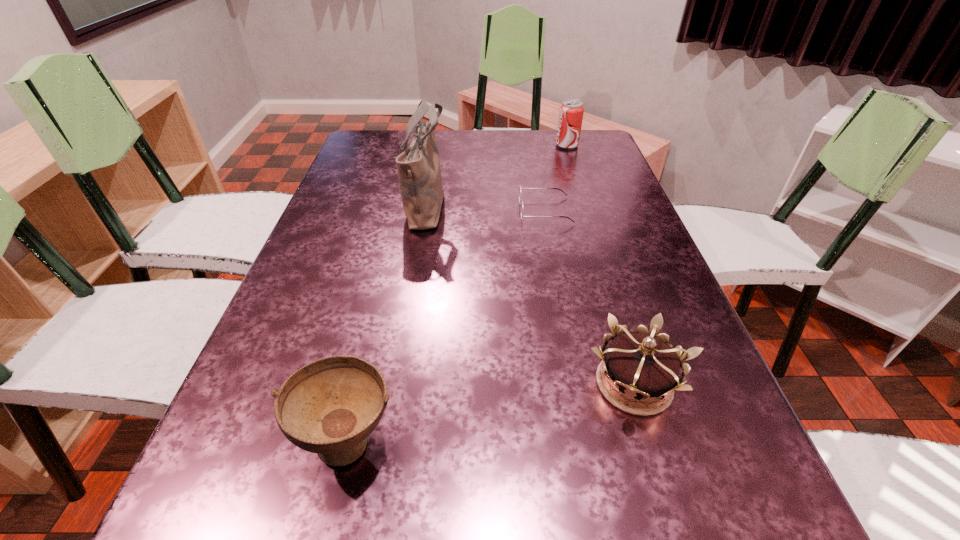
Identify the location of free space located 0.390m on the front-facing side of the spectacles. Image resolution: width=960 pixels, height=540 pixels. (372, 211).

The image size is (960, 540). What are the coordinates of `blank area located 0.310m on the front-facing side of the spectacles` in the screenshot? It's located at (402, 211).

Locate an element on the screen. object present at the far edge is located at coordinates pyautogui.click(x=571, y=112).

Find the location of a particular element. object that is positioned at the left edge is located at coordinates (330, 406).

Locate an element on the screen. soda can that is positioned at the right edge is located at coordinates (571, 112).

You are a GUI agent. You are given a task and a screenshot of the screen. Output one action in this format:
    pyautogui.click(x=<x>, y=<y>)
    Task: Click on the crown positioned at the right edge
    This screenshot has width=960, height=540.
    Given the screenshot: What is the action you would take?
    pyautogui.click(x=642, y=365)

Where is `object positioned at the far right corner`? This screenshot has height=540, width=960. object positioned at the far right corner is located at coordinates (571, 112).

In the image, there is a desktop. What are the coordinates of `vacant space at the far edge` in the screenshot? It's located at (410, 142).

Where is `free space at the left edge`? free space at the left edge is located at coordinates (280, 380).

Find the location of a particular element. vacant space at the right edge of the desktop is located at coordinates 568,183.